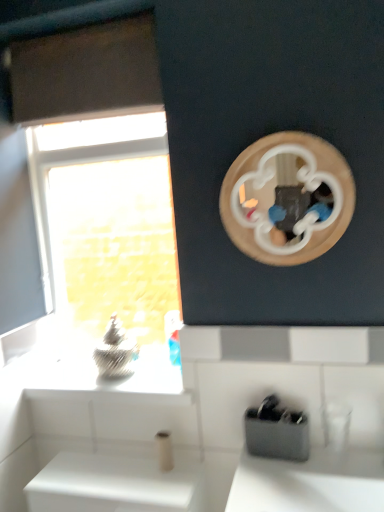
Question: Does black plastic toothbrush holder at lower center have a greater height compared to transparent glass window at left?

Choices:
 (A) no
 (B) yes

Answer: (A)

Question: Is black plastic toothbrush holder at lower center looking in the opposite direction of transparent glass window at left?

Choices:
 (A) yes
 (B) no

Answer: (B)

Question: Is black plastic toothbrush holder at lower center directly adjacent to transparent glass window at left?

Choices:
 (A) no
 (B) yes

Answer: (A)

Question: From the image's perspective, is black plastic toothbrush holder at lower center below transparent glass window at left?

Choices:
 (A) no
 (B) yes

Answer: (B)

Question: Can we say black plastic toothbrush holder at lower center lies outside transparent glass window at left?

Choices:
 (A) yes
 (B) no

Answer: (A)

Question: Is there a large distance between black plastic toothbrush holder at lower center and transparent glass window at left?

Choices:
 (A) yes
 (B) no

Answer: (A)

Question: From the image's perspective, is transparent glass window at left located above black plastic toothbrush holder at lower center?

Choices:
 (A) no
 (B) yes

Answer: (B)

Question: From a real-world perspective, is transparent glass window at left positioned under black plastic toothbrush holder at lower center based on gravity?

Choices:
 (A) no
 (B) yes

Answer: (A)

Question: Is transparent glass window at left bigger than black plastic toothbrush holder at lower center?

Choices:
 (A) no
 (B) yes

Answer: (B)

Question: From a real-world perspective, is transparent glass window at left physically above black plastic toothbrush holder at lower center?

Choices:
 (A) no
 (B) yes

Answer: (B)

Question: Is transparent glass window at left wider than black plastic toothbrush holder at lower center?

Choices:
 (A) yes
 (B) no

Answer: (B)

Question: Considering the relative sizes of transparent glass window at left and black plastic toothbrush holder at lower center in the image provided, is transparent glass window at left shorter than black plastic toothbrush holder at lower center?

Choices:
 (A) yes
 (B) no

Answer: (B)

Question: Looking at the image, does transparent glass window at left seem bigger or smaller compared to black plastic toothbrush holder at lower center?

Choices:
 (A) small
 (B) big

Answer: (B)